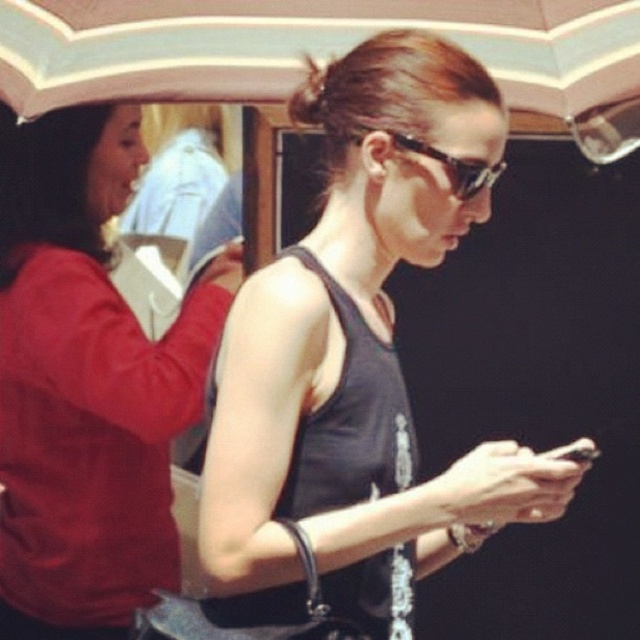
You are standing at the point marked as point (77, 625) and want to take a photo of the person under the umbrella. Since you are 2.46 meters away from the viewer, can you use a standard camera with a 50mm lens to capture the entire scene without moving closer?

The distance between you and the viewer is 2.46 meters. A standard 50mm lens has an angle of view of about 46 degrees, which should allow capturing the entire scene at this distance without needing to move closer.

You are a fashion designer observing the scene. Which item would require more fabric to produce, the matte red sweater at left or the white striped fabric umbrella at upper center?

The matte red sweater at left is bigger than the white striped fabric umbrella at upper center, so it would require more fabric to produce.

You are planning to join a picnic under the white striped fabric umbrella at upper center. You are wearing a matte red sweater at left. Will you be protected from the rain?

The matte red sweater at left is positioned under the white striped fabric umbrella at upper center, so yes, you will be protected from the rain.